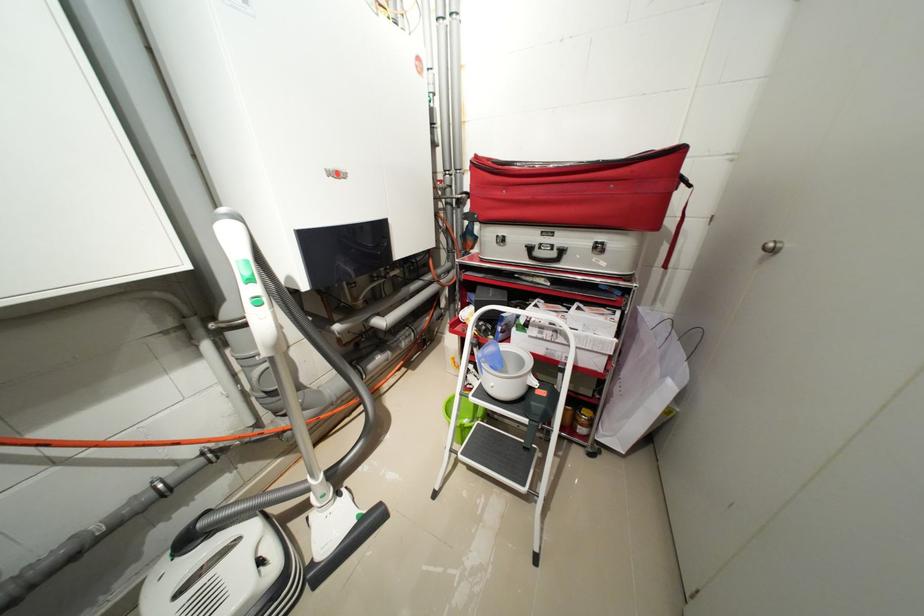
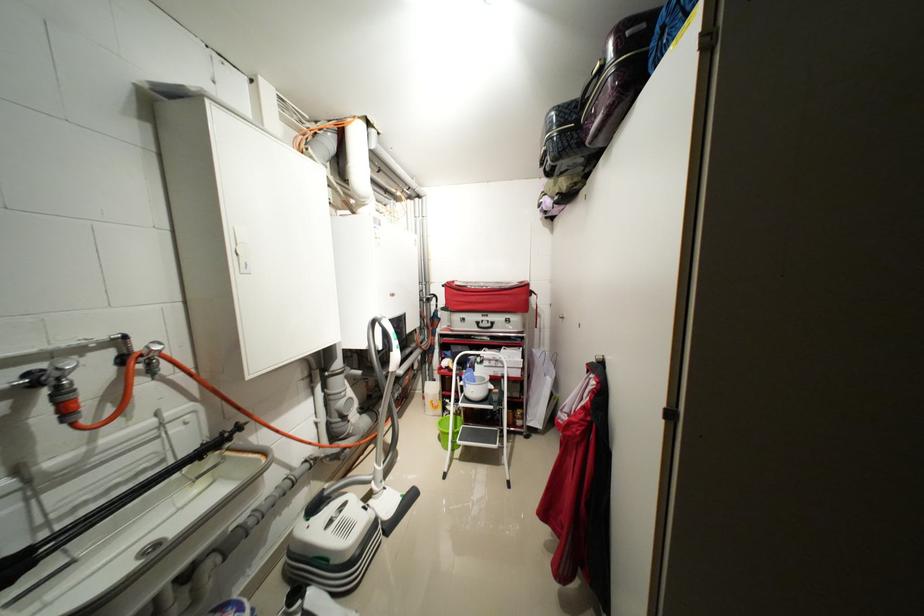
The point at (561, 254) is marked in the first image. Where is the corresponding point in the second image?

(496, 326)